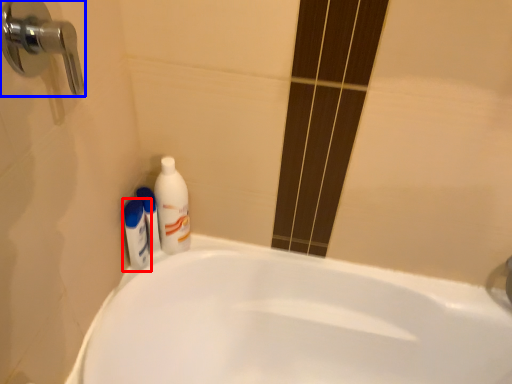
Question: Which object appears closest to the camera in this image, mouthwash (highlighted by a red box) or door handle (highlighted by a blue box)?

Choices:
 (A) mouthwash
 (B) door handle

Answer: (B)